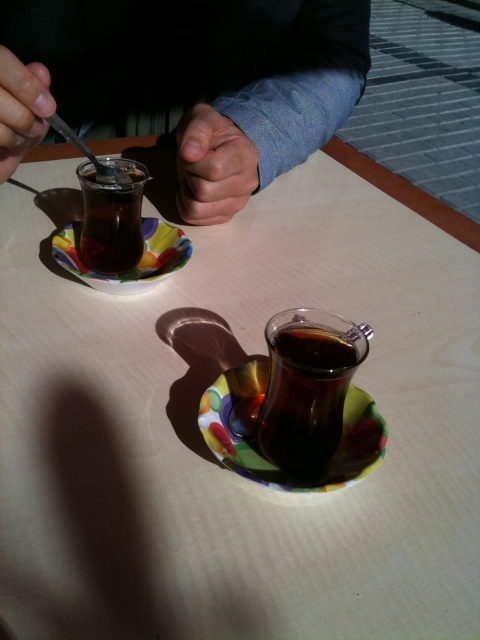
Question: Which point is closer to the camera?

Choices:
 (A) (73, 259)
 (B) (238, 186)
 (C) (26, 144)

Answer: (C)

Question: Does matte glass cup at upper center lie behind translucent glass cup at left?

Choices:
 (A) yes
 (B) no

Answer: (B)

Question: Which of the following is the closest to the observer?

Choices:
 (A) multicolored ceramic saucer at lower left
 (B) multicolored ceramic saucer at center
 (C) matte glass cup at upper center
 (D) skinny-fingered hand at center

Answer: (B)

Question: Which of the following is the closest to the observer?

Choices:
 (A) (73, 253)
 (B) (264, 484)
 (C) (197, 179)

Answer: (B)

Question: Can you confirm if matte glass cup at upper center is positioned to the right of translucent glass cup at left?

Choices:
 (A) no
 (B) yes

Answer: (B)

Question: Is matte glass cup at upper center wider than multicolored ceramic saucer at lower left?

Choices:
 (A) yes
 (B) no

Answer: (A)